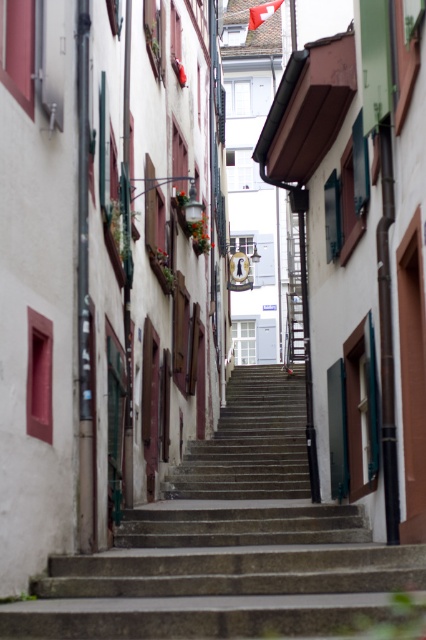
Question: Is concrete stairs at center wider than red fabric flag at upper center?

Choices:
 (A) no
 (B) yes

Answer: (B)

Question: Among these points, which one is farthest from the camera?

Choices:
 (A) (278, 6)
 (B) (291, 600)

Answer: (A)

Question: Is concrete stairs at center smaller than red fabric flag at upper center?

Choices:
 (A) yes
 (B) no

Answer: (B)

Question: Is concrete stairs at center wider than red fabric flag at upper center?

Choices:
 (A) no
 (B) yes

Answer: (B)

Question: Which point is farther to the camera?

Choices:
 (A) red fabric flag at upper center
 (B) concrete stairs at center

Answer: (A)